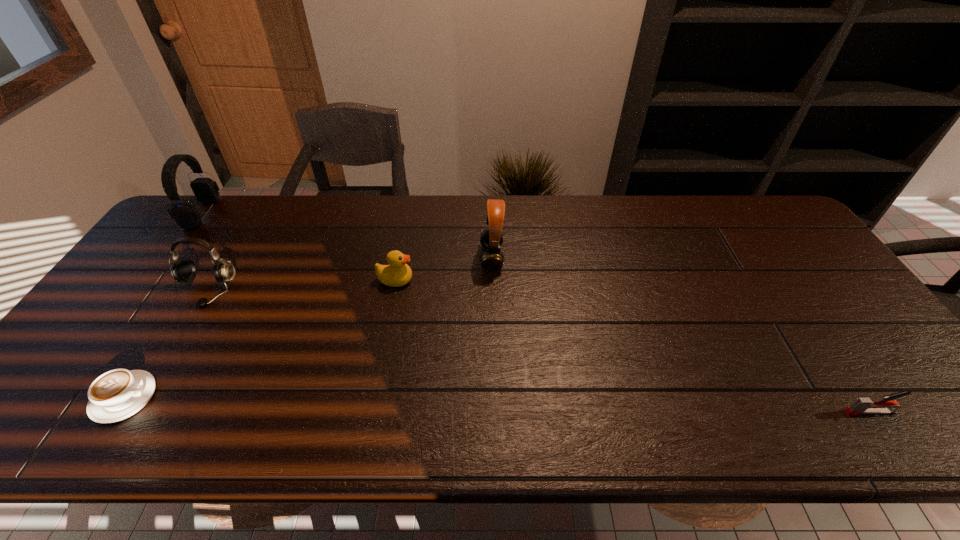
This screenshot has height=540, width=960. In order to click on vacant area that lies between the shortest object and the fourth shortest object in this screenshot , I will do `click(165, 344)`.

Locate an element on the screen. This screenshot has width=960, height=540. vacant region between the shortest object and the duck is located at coordinates (259, 339).

You are a GUI agent. You are given a task and a screenshot of the screen. Output one action in this format:
    pyautogui.click(x=<x>, y=<y>)
    Task: Click on the free spot between the duck and the second object from right to left
    
    Given the screenshot: What is the action you would take?
    pyautogui.click(x=444, y=269)

What are the coordinates of `vacant space in between the second shortest object and the fourth object from left to right` in the screenshot? It's located at (633, 346).

Where is `the fourth closest object relative to the duck`? This screenshot has height=540, width=960. the fourth closest object relative to the duck is located at coordinates click(186, 215).

You are a GUI agent. You are given a task and a screenshot of the screen. Output one action in this format:
    pyautogui.click(x=<x>, y=<y>)
    Task: Click on the object that is the third nearest to the rightmost headset
    This screenshot has width=960, height=540.
    Given the screenshot: What is the action you would take?
    pyautogui.click(x=116, y=395)

Image resolution: width=960 pixels, height=540 pixels. I want to click on headset that is the second closest to the fifth object from left to right, so click(x=186, y=215).

Find the location of a particular element. The height and width of the screenshot is (540, 960). headset that is the nearest to the leftmost headset is located at coordinates (183, 270).

Locate an element on the screen. free region that satisfies the following two spatial constraints: 1. on the ear cups of the rightmost headset; 2. with the microphone on the side of the second headset from left to right is located at coordinates (492, 291).

Image resolution: width=960 pixels, height=540 pixels. In order to click on free point that satisfies the following two spatial constraints: 1. on the ear cups of the fifth object from left to right; 2. with the microphone on the side of the third tallest object in this screenshot , I will do `click(492, 291)`.